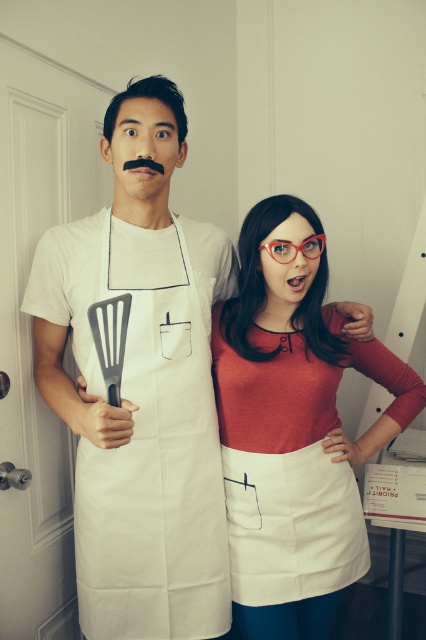
Question: Which object is closer to the camera taking this photo?

Choices:
 (A) matte white apron at center
 (B) white fabric apron at left

Answer: (B)

Question: From the image, what is the correct spatial relationship of matte white apron at center in relation to white fabric apron at left?

Choices:
 (A) left
 (B) right

Answer: (B)

Question: Is matte white apron at center thinner than white fabric apron at left?

Choices:
 (A) yes
 (B) no

Answer: (B)

Question: Is matte white apron at center smaller than white fabric apron at left?

Choices:
 (A) yes
 (B) no

Answer: (A)

Question: Which point is closer to the camera?

Choices:
 (A) white fabric apron at left
 (B) matte white apron at center

Answer: (A)